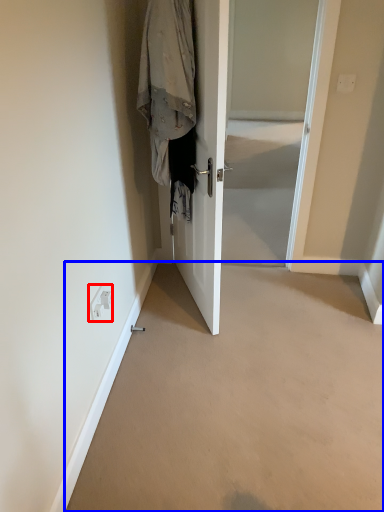
Question: Which point is closer to the camera, electric outlet (highlighted by a red box) or corridor (highlighted by a blue box)?

Choices:
 (A) electric outlet
 (B) corridor

Answer: (B)